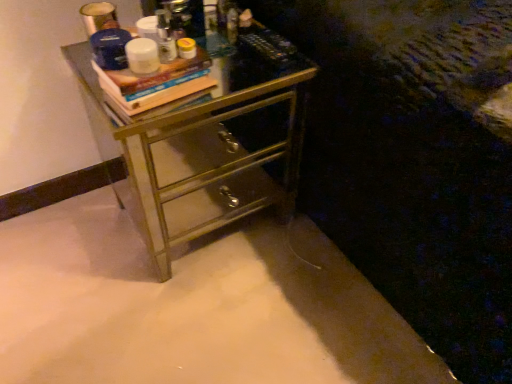
Question: Should I look upward or downward to see metallic gold chest of drawers at center?

Choices:
 (A) down
 (B) up

Answer: (B)

Question: Is wooden book at upper center smaller than metallic gold chest of drawers at center?

Choices:
 (A) no
 (B) yes

Answer: (B)

Question: Considering the relative sizes of wooden book at upper center and metallic gold chest of drawers at center in the image provided, is wooden book at upper center thinner than metallic gold chest of drawers at center?

Choices:
 (A) yes
 (B) no

Answer: (A)

Question: Is wooden book at upper center to the right of metallic gold chest of drawers at center from the viewer's perspective?

Choices:
 (A) no
 (B) yes

Answer: (A)

Question: Can we say wooden book at upper center lies outside metallic gold chest of drawers at center?

Choices:
 (A) no
 (B) yes

Answer: (B)

Question: From a real-world perspective, does wooden book at upper center sit lower than metallic gold chest of drawers at center?

Choices:
 (A) no
 (B) yes

Answer: (A)

Question: Is wooden book at upper center turned away from metallic gold chest of drawers at center?

Choices:
 (A) no
 (B) yes

Answer: (A)

Question: Can you confirm if metallic gold chest of drawers at center is thinner than wooden book at upper center?

Choices:
 (A) yes
 (B) no

Answer: (B)

Question: Does metallic gold chest of drawers at center appear on the left side of wooden book at upper center?

Choices:
 (A) yes
 (B) no

Answer: (B)

Question: Is metallic gold chest of drawers at center aimed at wooden book at upper center?

Choices:
 (A) yes
 (B) no

Answer: (B)

Question: From a real-world perspective, is metallic gold chest of drawers at center positioned over wooden book at upper center based on gravity?

Choices:
 (A) yes
 (B) no

Answer: (B)

Question: Can you confirm if metallic gold chest of drawers at center is smaller than wooden book at upper center?

Choices:
 (A) no
 (B) yes

Answer: (A)

Question: Considering the relative positions of metallic gold chest of drawers at center and wooden book at upper center in the image provided, is metallic gold chest of drawers at center to the right of wooden book at upper center from the viewer's perspective?

Choices:
 (A) yes
 (B) no

Answer: (A)

Question: Considering the positions of metallic gold chest of drawers at center and wooden book at upper center in the image, is metallic gold chest of drawers at center taller or shorter than wooden book at upper center?

Choices:
 (A) tall
 (B) short

Answer: (A)